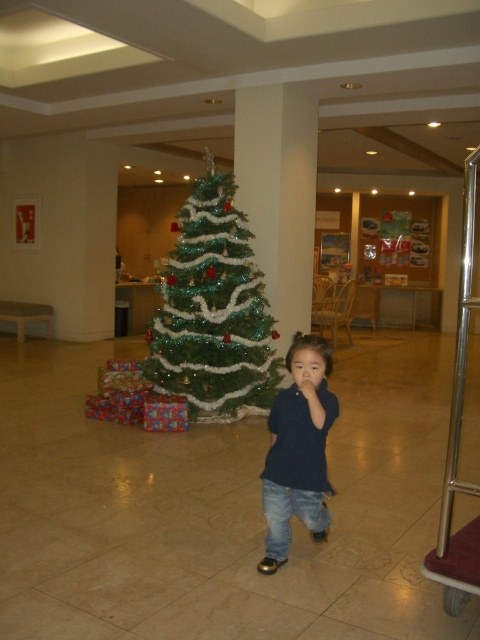
You are standing in the lobby and want to take a photo of the green shiny christmas tree at center and the dark blue shirt at center together in the same frame. Which direction should you move to ensure both are visible?

You should move to the right of the dark blue shirt at center so that the green shiny christmas tree at center, which is to the left of the dark blue shirt at center, comes into view on the left side of the frame.